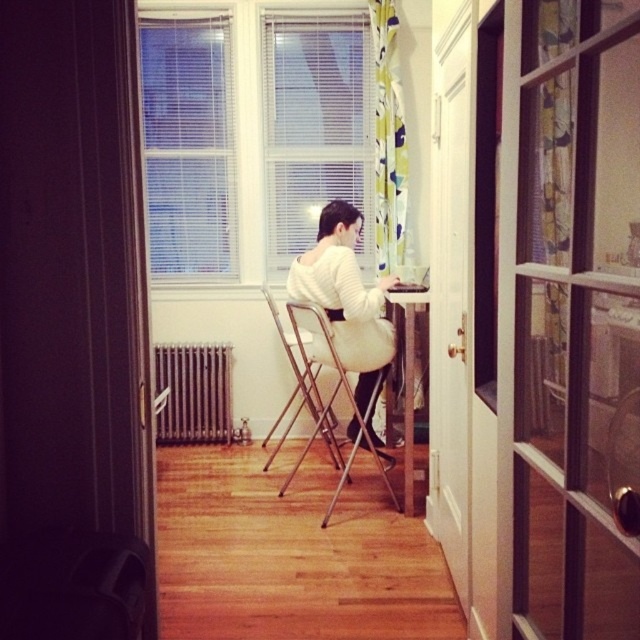
Who is taller, wooden table at center or metallic silver folding chair at center?

Standing taller between the two is wooden table at center.

Image resolution: width=640 pixels, height=640 pixels. What do you see at coordinates (404, 376) in the screenshot? I see `wooden table at center` at bounding box center [404, 376].

Does point (401, 316) come closer to viewer compared to point (307, 364)?

No.

Where is `wooden table at center`? The image size is (640, 640). wooden table at center is located at coordinates (404, 376).

Can you confirm if metallic silver chair at center is positioned below wooden table at center?

Yes, metallic silver chair at center is below wooden table at center.

Does metallic silver chair at center have a greater height compared to wooden table at center?

No.

You are a GUI agent. You are given a task and a screenshot of the screen. Output one action in this format:
    pyautogui.click(x=<x>, y=<y>)
    Task: Click on the metallic silver chair at center
    The height and width of the screenshot is (640, 640).
    Given the screenshot: What is the action you would take?
    pyautogui.click(x=317, y=369)

This screenshot has width=640, height=640. Find the location of `metallic silver chair at center`. metallic silver chair at center is located at coordinates click(x=317, y=369).

Is clear glass screen door at center positioned before white soft sweater at center?

Yes, it is in front of white soft sweater at center.

Between point (621, 531) and point (349, 339), which one is positioned in front?

Point (621, 531) is more forward.

The image size is (640, 640). I want to click on clear glass screen door at center, so click(x=577, y=323).